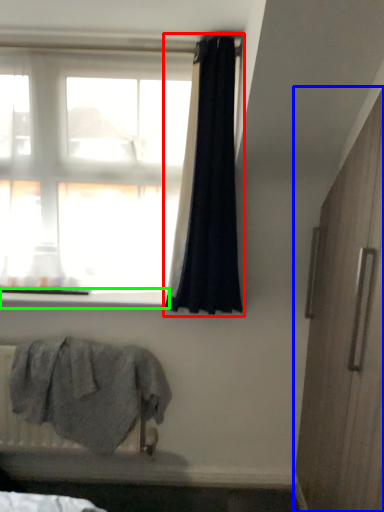
Question: Which object is positioned closest to curtain (highlighted by a red box)? Select from screen door (highlighted by a blue box) and window sill (highlighted by a green box).

Choices:
 (A) screen door
 (B) window sill

Answer: (B)